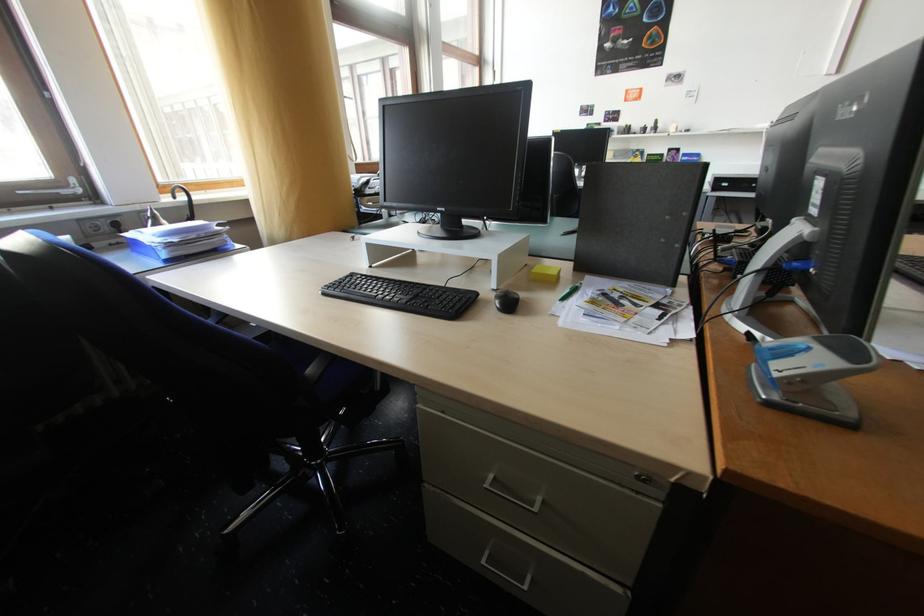
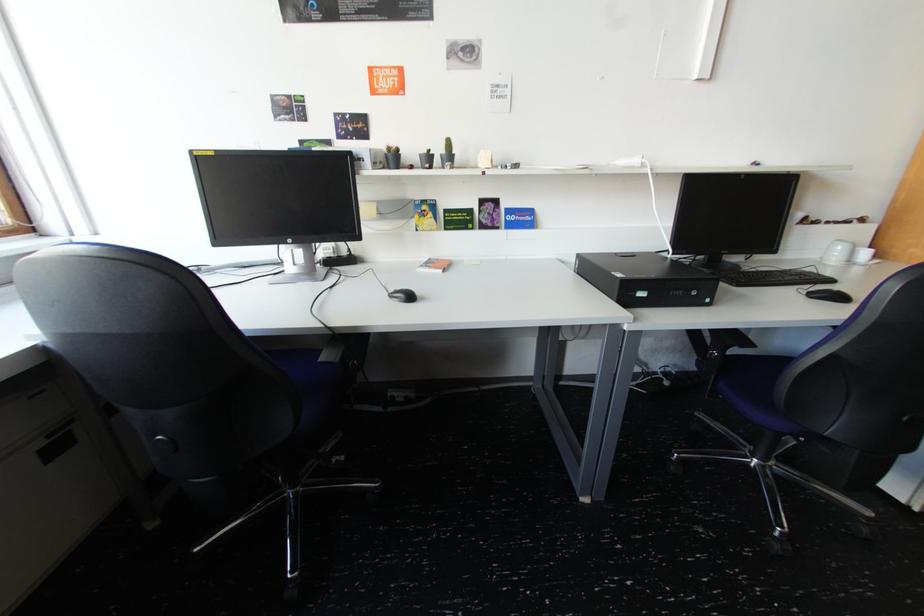
In the second image, find the point that corresponds to (x=734, y=185) in the first image.

(650, 294)